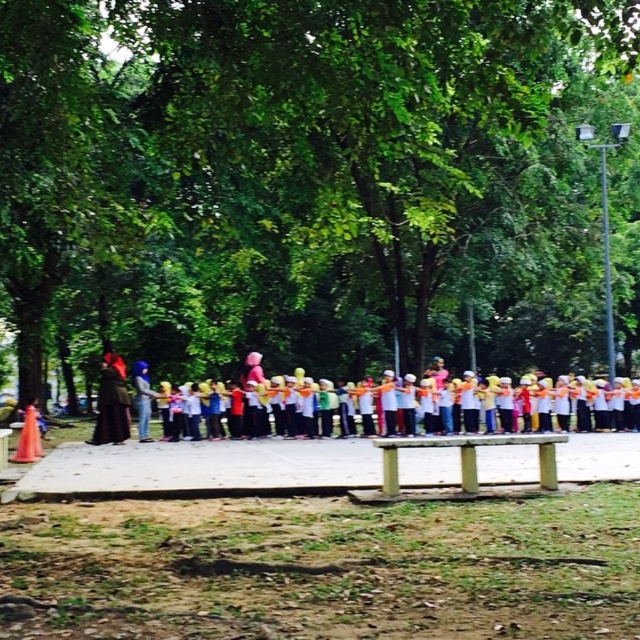
Question: Considering the real-world distances, which object is farthest from the white cotton scarf at center?

Choices:
 (A) green leafy tree at upper center
 (B) dark brown fabric at left
 (C) matte purple hijab at center
 (D) brown wooden picnic table at center

Answer: (D)

Question: Which of these objects is positioned closest to the dark brown fabric at left?

Choices:
 (A) brown wooden picnic table at center
 (B) white cotton scarf at center
 (C) green leafy tree at upper center

Answer: (C)

Question: Which point is closer to the camera taking this photo?

Choices:
 (A) (461, 244)
 (B) (122, 394)
 (C) (429, 428)

Answer: (B)

Question: Is dark brown fabric at left behind matte purple hijab at center?

Choices:
 (A) no
 (B) yes

Answer: (A)

Question: Is dark brown fabric at left wider than matte purple hijab at center?

Choices:
 (A) yes
 (B) no

Answer: (A)

Question: Is green leafy tree at upper center below dark brown fabric at left?

Choices:
 (A) yes
 (B) no

Answer: (B)